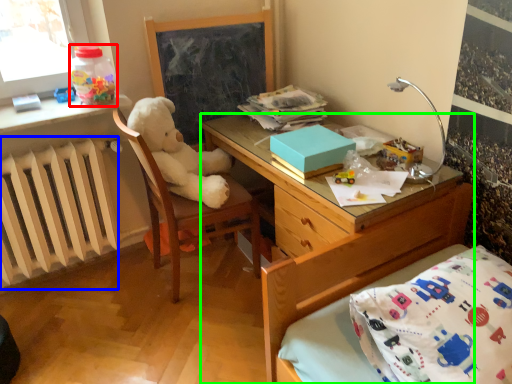
Question: Estimate the real-world distances between objects in this image. Which object is farther from bottle (highlighted by a red box), radiator (highlighted by a blue box) or desk (highlighted by a green box)?

Choices:
 (A) radiator
 (B) desk

Answer: (B)